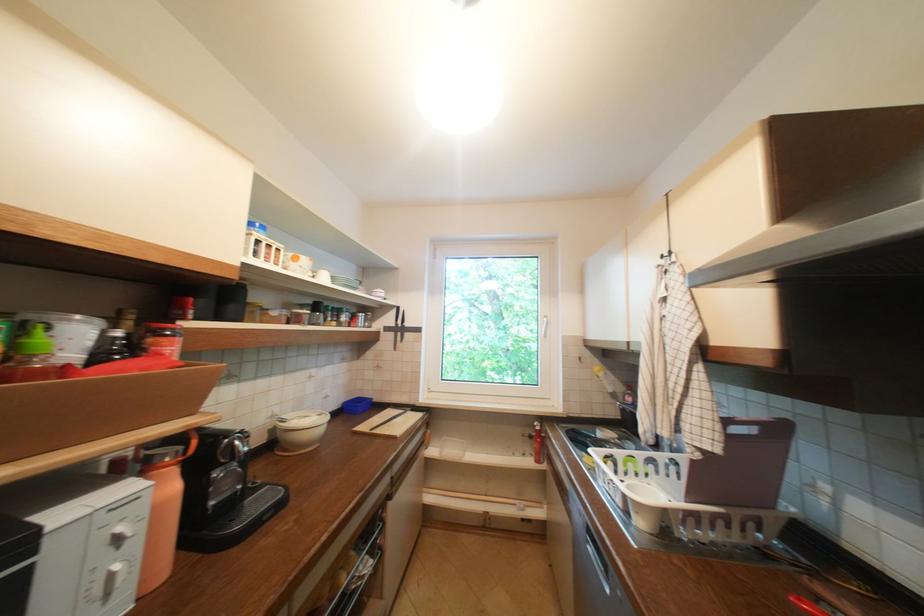
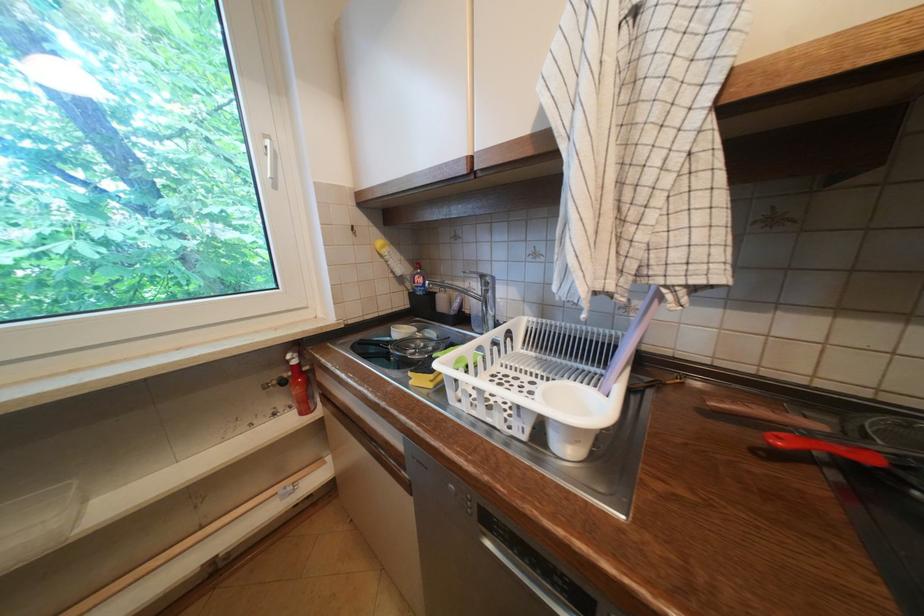
Locate, in the second image, the point that corresponds to (592,460) in the first image.

(419, 383)